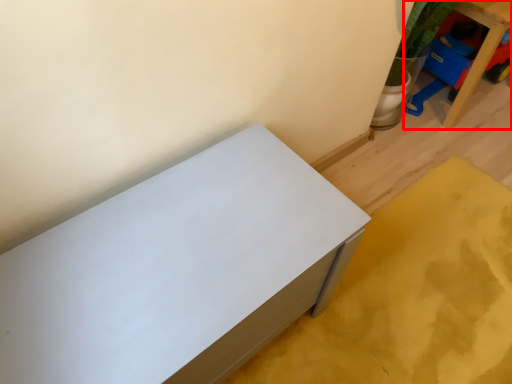
Question: From the image's perspective, where is furniture (annotated by the red box) located relative to furniture?

Choices:
 (A) below
 (B) above

Answer: (B)